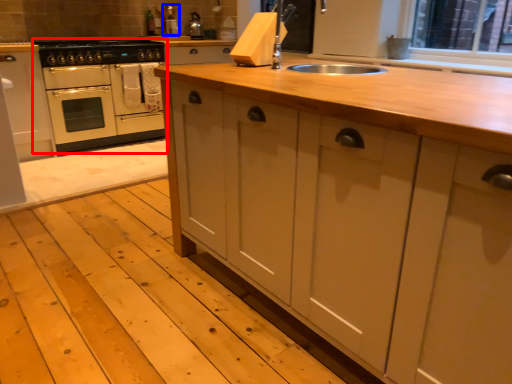
Question: Which of the following is the farthest to the observer, home appliance (highlighted by a red box) or appliance (highlighted by a blue box)?

Choices:
 (A) home appliance
 (B) appliance

Answer: (B)